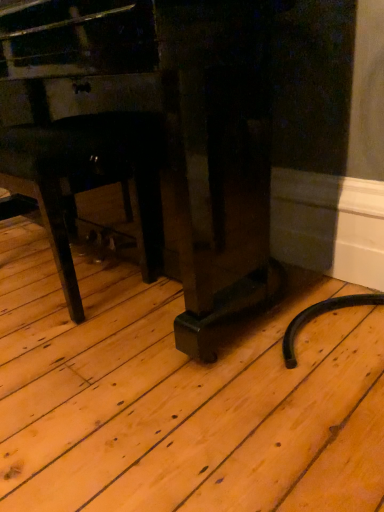
Question: In the image, is matte black piano at center, arranged as the 1th furniture when viewed from the right, on the left side or the right side of black matte chair at lower left, acting as the 2th furniture starting from the right?

Choices:
 (A) right
 (B) left

Answer: (A)

Question: Is matte black piano at center, which ranks as the 2th furniture in left-to-right order, inside or outside of black matte chair at lower left, the first furniture viewed from the left?

Choices:
 (A) outside
 (B) inside

Answer: (A)

Question: From the image's perspective, is matte black piano at center, arranged as the 1th furniture when viewed from the right, positioned above or below black matte chair at lower left, the first furniture viewed from the left?

Choices:
 (A) below
 (B) above

Answer: (B)

Question: Is point (67, 148) positioned closer to the camera than point (16, 78)?

Choices:
 (A) closer
 (B) farther

Answer: (A)

Question: Is black matte chair at lower left, the first furniture viewed from the left, taller or shorter than matte black piano at center, which ranks as the 2th furniture in left-to-right order?

Choices:
 (A) short
 (B) tall

Answer: (A)

Question: Relative to matte black piano at center, arranged as the 1th furniture when viewed from the right, is black matte chair at lower left, the first furniture viewed from the left, in front or behind?

Choices:
 (A) behind
 (B) front

Answer: (A)

Question: From a real-world perspective, is black matte chair at lower left, acting as the 2th furniture starting from the right, positioned above or below matte black piano at center, which ranks as the 2th furniture in left-to-right order?

Choices:
 (A) below
 (B) above

Answer: (A)